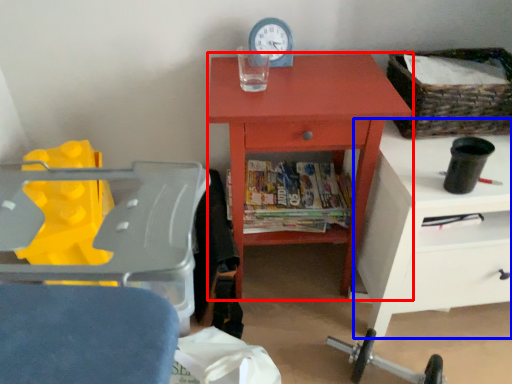
Question: Which point is further to the camera, chest of drawers (highlighted by a red box) or nightstand (highlighted by a blue box)?

Choices:
 (A) chest of drawers
 (B) nightstand

Answer: (A)